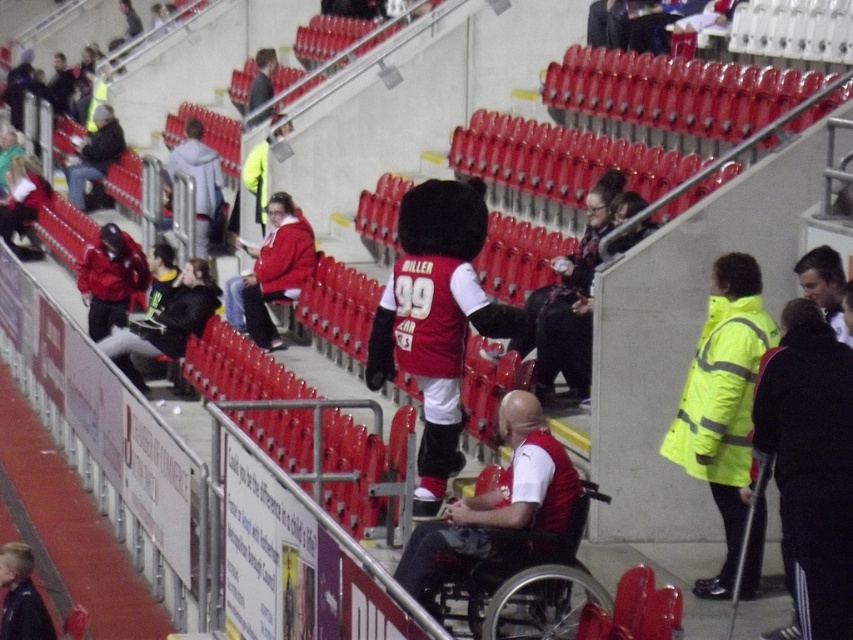
Question: Which object is the farthest from the light gray hoodie at upper left?

Choices:
 (A) yellow high-visibility jacket at right
 (B) matte black jacket at upper left
 (C) matte black jacket at center

Answer: (A)

Question: Which object is closer to the camera taking this photo?

Choices:
 (A) matte black jacket at center
 (B) yellow reflective jacket at center

Answer: (B)

Question: Does black plastic wheelchair at center have a smaller size compared to light gray hoodie at upper left?

Choices:
 (A) yes
 (B) no

Answer: (A)

Question: Which point is farther to the camera?

Choices:
 (A) black plastic wheelchair at center
 (B) matte black jacket at upper left
 (C) red jersey plush mascot at center
 (D) yellow reflective jacket at center

Answer: (B)

Question: Does red jersey plush mascot at center have a larger size compared to matte black jacket at upper left?

Choices:
 (A) no
 (B) yes

Answer: (A)

Question: Is yellow high-visibility jacket at right closer to the viewer compared to black plastic wheelchair at center?

Choices:
 (A) yes
 (B) no

Answer: (B)